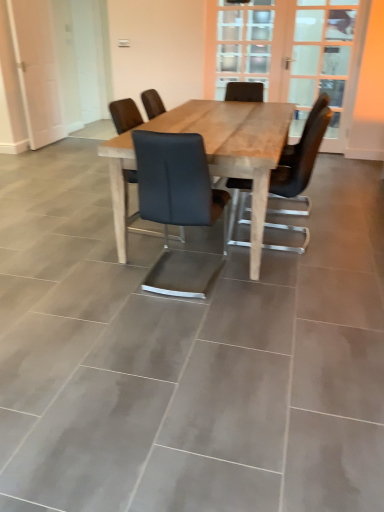
The height and width of the screenshot is (512, 384). What are the coordinates of `vacant point to the left of black leather chair at center, acting as the 2th chair starting from the left` in the screenshot? It's located at (111, 272).